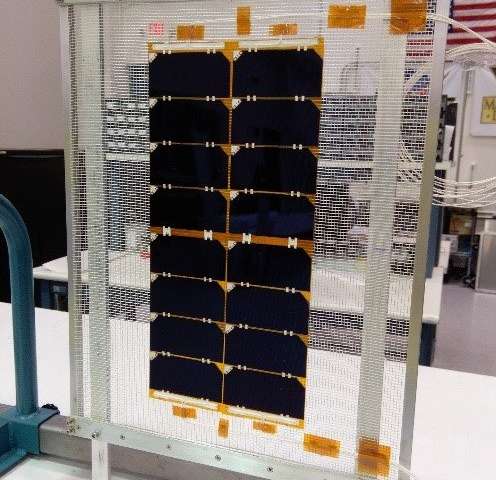
Image resolution: width=496 pixels, height=480 pixels. I want to click on screws, so click(68, 430), click(95, 436), click(120, 436), click(170, 447), click(219, 458), click(270, 468).